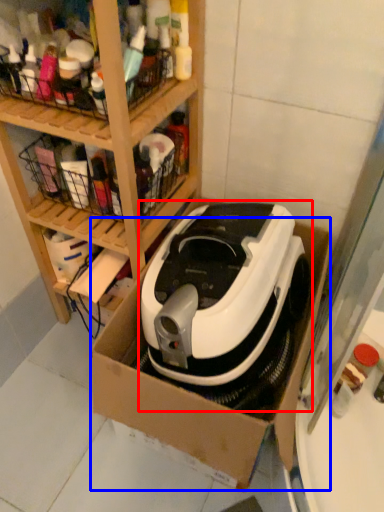
Question: Among these objects, which one is nearest to the camera, home appliance (highlighted by a red box) or cardboard box (highlighted by a blue box)?

Choices:
 (A) home appliance
 (B) cardboard box

Answer: (B)